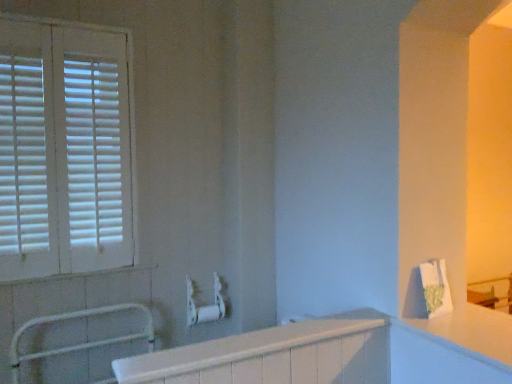
Question: Is white plastic towel bar at center wider or thinner than white matte metal balustrade at lower left?

Choices:
 (A) thin
 (B) wide

Answer: (B)

Question: Considering the positions of white plastic towel bar at center and white matte metal balustrade at lower left in the image, is white plastic towel bar at center taller or shorter than white matte metal balustrade at lower left?

Choices:
 (A) tall
 (B) short

Answer: (B)

Question: Estimate the real-world distances between objects in this image. Which object is closer to the white glossy countertop at right?

Choices:
 (A) white plastic towel bar at center
 (B) white glossy bathtub at center
 (C) white matte metal balustrade at lower left
 (D) white wooden blinds at left

Answer: (B)

Question: Estimate the real-world distances between objects in this image. Which object is farther from the white matte metal balustrade at lower left?

Choices:
 (A) white plastic towel bar at center
 (B) white wooden blinds at left
 (C) white glossy bathtub at center
 (D) white glossy countertop at right

Answer: (D)